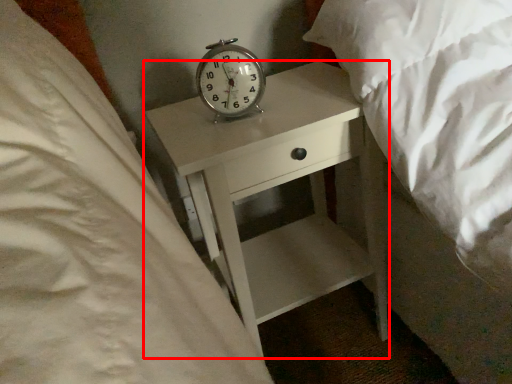
Question: From the image's perspective, where is nightstand (annotated by the red box) located relative to alarm clock?

Choices:
 (A) above
 (B) below

Answer: (B)